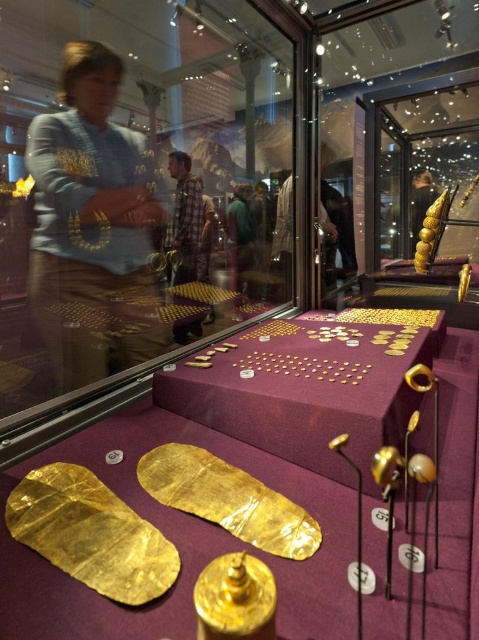
Question: Which object appears closest to the camera in this image?

Choices:
 (A) green fabric jacket at center
 (B) shiny gold ring at center
 (C) purple velvet table at center

Answer: (B)

Question: Is matte gold necklace at upper left positioned behind purple velvet table at center?

Choices:
 (A) no
 (B) yes

Answer: (B)

Question: Which point is closer to the camera?

Choices:
 (A) (260, 620)
 (B) (263, 332)

Answer: (A)

Question: Can you confirm if matte gold necklace at upper left is positioned to the right of purple velvet table at center?

Choices:
 (A) yes
 (B) no

Answer: (B)

Question: Considering the real-world distances, which object is farthest from the purple velvet table at center?

Choices:
 (A) matte gold necklace at upper left
 (B) green fabric jacket at center

Answer: (B)

Question: Can you confirm if matte gold necklace at upper left is thinner than shiny gold ring at center?

Choices:
 (A) yes
 (B) no

Answer: (B)